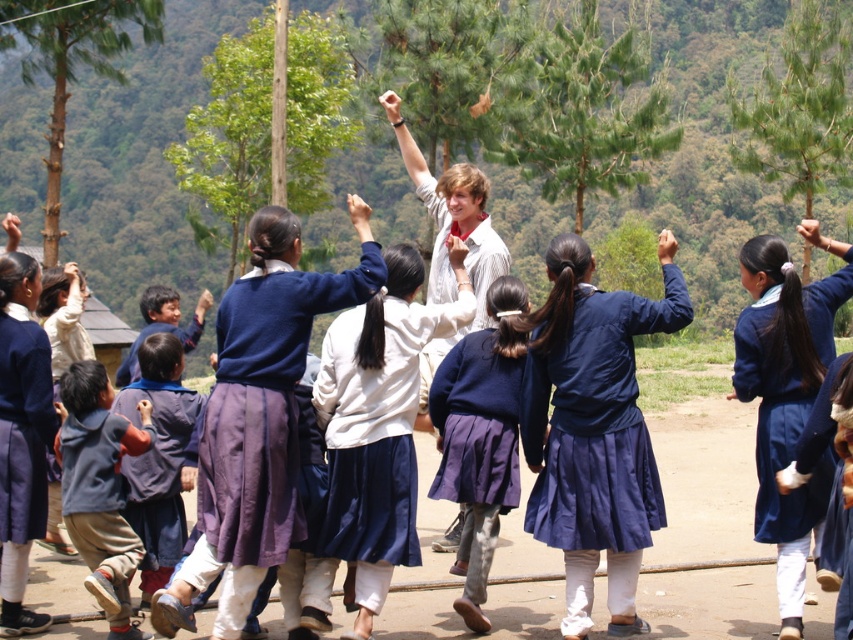
Is matte blue uniform at center thinner than matte blue sweater at upper center?

Correct, matte blue uniform at center's width is less than matte blue sweater at upper center's.

Can you confirm if matte blue uniform at center is smaller than matte blue sweater at upper center?

Yes.

Does point (833, 465) come behind point (199, 316)?

No, (833, 465) is closer to viewer.

Identify the location of matte blue uniform at center. The image size is (853, 640). (786, 403).

Does navy blue skirt at center have a lesser width compared to smooth wooden stick at upper center?

Yes.

Is point (599, 356) farther from camera compared to point (810, 227)?

That is False.

Locate an element on the screen. The width and height of the screenshot is (853, 640). navy blue skirt at center is located at coordinates (592, 432).

Can you confirm if navy blue skirt at center is positioned to the left of smooth skin hand at center?

Correct, you'll find navy blue skirt at center to the left of smooth skin hand at center.

Who is more distant from viewer, (567, 445) or (660, 252)?

The point (660, 252) is behind.

This screenshot has height=640, width=853. Find the location of `navy blue skirt at center`. navy blue skirt at center is located at coordinates (592, 432).